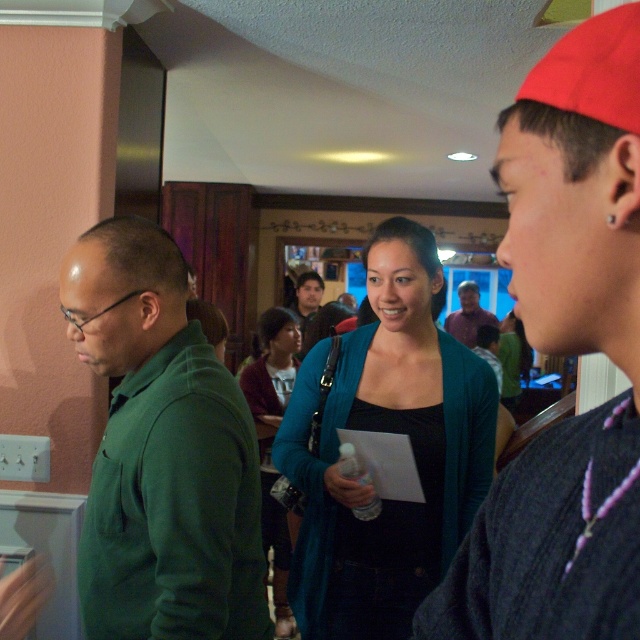
You are standing in the room and want to reach the point marked as point [115,390]. If your average walking speed is 3 feet per second, how many seconds will it take you to reach that point?

The distance between you and point [115,390] is 4.16 feet. At a speed of 3 feet per second, it would take approximately 1.39 seconds to reach the point.

You are a photographer at this gathering and want to capture a photo that includes both the green matte sweater at left and the matte black shirt at center. Based on their positions, which one should you focus on first to ensure both are in frame?

The green matte sweater at left is positioned under the matte black shirt at center, so you should focus on the matte black shirt at center first to ensure both are in frame.